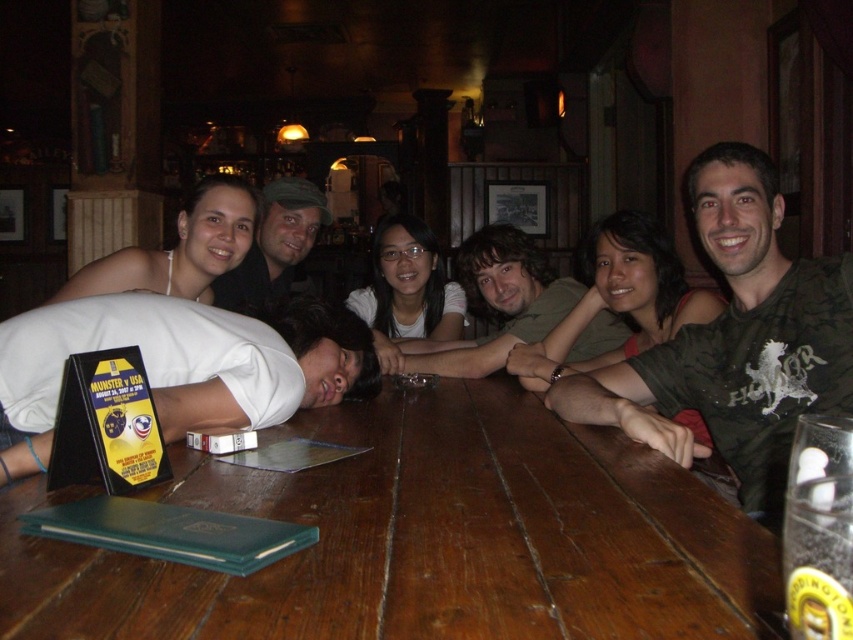
Who is shorter, dark green t-shirt at center or dark brown hair at center?

With less height is dark brown hair at center.

Who is taller, dark green t-shirt at center or dark brown hair at center?

Standing taller between the two is dark green t-shirt at center.

The height and width of the screenshot is (640, 853). What do you see at coordinates (734, 340) in the screenshot? I see `dark green t-shirt at center` at bounding box center [734, 340].

Where is `dark green t-shirt at center`? The height and width of the screenshot is (640, 853). dark green t-shirt at center is located at coordinates pos(734,340).

Who is more forward, [387,499] or [755,312]?

Point [387,499] is more forward.

How far apart are brown wooden table at center and dark green t-shirt at center?

brown wooden table at center and dark green t-shirt at center are 42.36 centimeters apart.

Locate an element on the screen. brown wooden table at center is located at coordinates (424, 538).

I want to click on brown wooden table at center, so pos(424,538).

Is dark green t-shirt at center to the left of matte black shirt at center from the viewer's perspective?

No, dark green t-shirt at center is not to the left of matte black shirt at center.

Describe the element at coordinates (734, 340) in the screenshot. I see `dark green t-shirt at center` at that location.

Image resolution: width=853 pixels, height=640 pixels. Identify the location of dark green t-shirt at center. (734, 340).